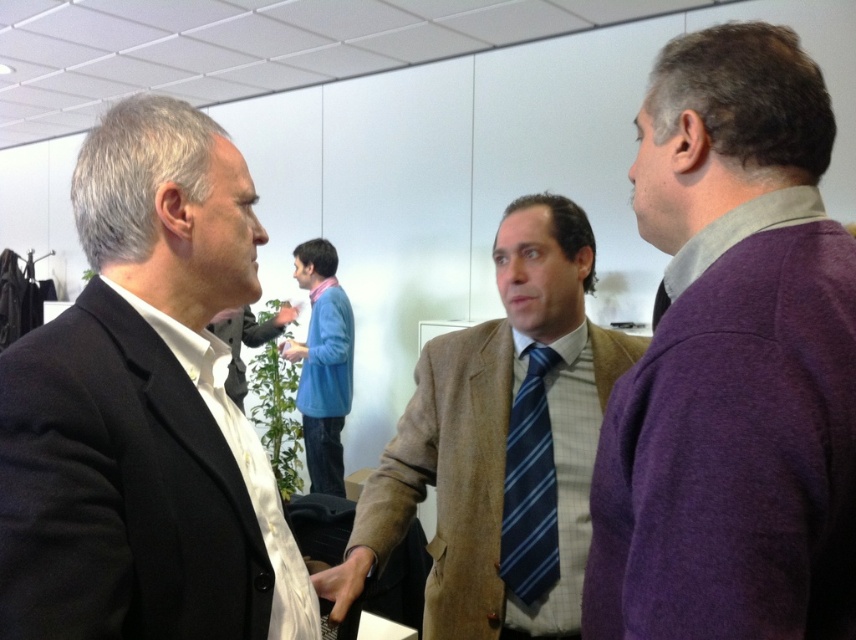
Based on the photo, you are a tailor who needs to adjust the width of the black matte suit at left and the blue striped tie at center to ensure they are the same width. Based on the image, which item requires a reduction in width?

The black matte suit at left is wider than the blue striped tie at center, so the black matte suit at left needs to be reduced in width to match the blue striped tie at center.

You are a photographer trying to capture a candid shot of the group. You want to ensure that the purple wool sweater at right and the blue striped tie at center are both in the frame. Based on their positions, which object is closer to the right edge of the photo?

The purple wool sweater at right is positioned on the right side of the blue striped tie at center, so it is closer to the right edge of the photo.

You are organizing a charity clothing drive and need to categorize the sweaters based on their size. Given the purple wool sweater at right and the blue fleece sweater at center, which one should be placed in the small size bin?

The purple wool sweater at right is smaller than the blue fleece sweater at center, so it should be placed in the small size bin.